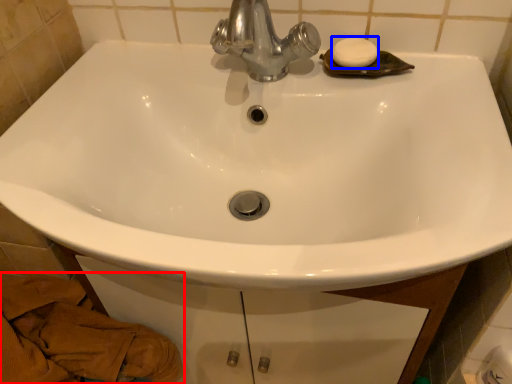
Question: Which point is closer to the camera, material (highlighted by a red box) or soap (highlighted by a blue box)?

Choices:
 (A) material
 (B) soap

Answer: (A)